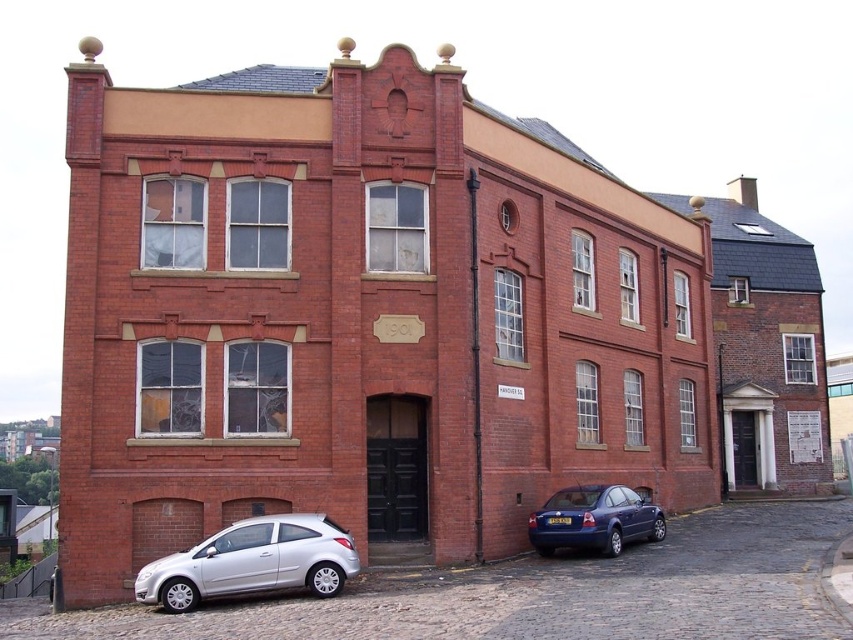
Question: In this image, where is silver metallic hatchback at lower left located relative to metallic blue sedan at lower right?

Choices:
 (A) above
 (B) below

Answer: (A)

Question: Considering the relative positions of silver metallic hatchback at lower left and metallic blue sedan at lower right in the image provided, where is silver metallic hatchback at lower left located with respect to metallic blue sedan at lower right?

Choices:
 (A) left
 (B) right

Answer: (A)

Question: Among these points, which one is farthest from the camera?

Choices:
 (A) (283, 516)
 (B) (540, 529)

Answer: (B)

Question: Which point is closer to the camera?

Choices:
 (A) (218, 550)
 (B) (584, 536)

Answer: (A)

Question: Can you confirm if silver metallic hatchback at lower left is positioned below metallic blue sedan at lower right?

Choices:
 (A) yes
 (B) no

Answer: (B)

Question: Which object is closer to the camera taking this photo?

Choices:
 (A) metallic blue sedan at lower right
 (B) silver metallic hatchback at lower left

Answer: (B)